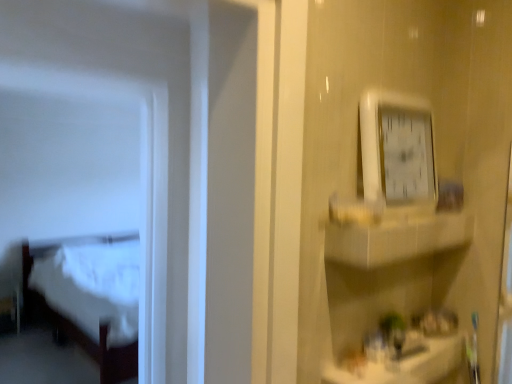
Question: Do you think white wood bed at left is within white glossy cabinet at upper right, or outside of it?

Choices:
 (A) outside
 (B) inside

Answer: (A)

Question: In terms of width, does white wood bed at left look wider or thinner when compared to white glossy cabinet at upper right?

Choices:
 (A) wide
 (B) thin

Answer: (A)

Question: Which is farther from the white glossy counter top at lower right?

Choices:
 (A) white glossy cabinet at upper right
 (B) white wood bed at left
 (C) white plastic clock at upper right

Answer: (B)

Question: Based on their relative distances, which object is nearer to the white glossy counter top at lower right?

Choices:
 (A) white glossy cabinet at upper right
 (B) white wood bed at left
 (C) white plastic clock at upper right

Answer: (A)